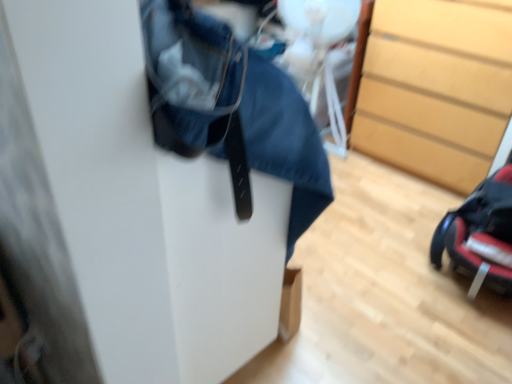
Question: Is black plastic baby carriage at lower right completely or partially outside of wooden chest of drawers at right?

Choices:
 (A) yes
 (B) no

Answer: (A)

Question: Considering the relative sizes of black plastic baby carriage at lower right and wooden chest of drawers at right in the image provided, is black plastic baby carriage at lower right wider than wooden chest of drawers at right?

Choices:
 (A) no
 (B) yes

Answer: (A)

Question: From a real-world perspective, does black plastic baby carriage at lower right stand above wooden chest of drawers at right?

Choices:
 (A) no
 (B) yes

Answer: (A)

Question: Is black plastic baby carriage at lower right closer to camera compared to wooden chest of drawers at right?

Choices:
 (A) no
 (B) yes

Answer: (B)

Question: Is black plastic baby carriage at lower right oriented towards wooden chest of drawers at right?

Choices:
 (A) no
 (B) yes

Answer: (A)

Question: Can you confirm if black plastic baby carriage at lower right is thinner than wooden chest of drawers at right?

Choices:
 (A) no
 (B) yes

Answer: (B)

Question: Does wooden chest of drawers at right have a lesser height compared to black plastic baby carriage at lower right?

Choices:
 (A) no
 (B) yes

Answer: (A)

Question: Is wooden chest of drawers at right smaller than black plastic baby carriage at lower right?

Choices:
 (A) no
 (B) yes

Answer: (A)

Question: Does wooden chest of drawers at right have a greater height compared to black plastic baby carriage at lower right?

Choices:
 (A) no
 (B) yes

Answer: (B)

Question: From the image's perspective, would you say wooden chest of drawers at right is shown under black plastic baby carriage at lower right?

Choices:
 (A) yes
 (B) no

Answer: (B)

Question: Is wooden chest of drawers at right surrounding black plastic baby carriage at lower right?

Choices:
 (A) no
 (B) yes

Answer: (A)

Question: Does wooden chest of drawers at right appear on the left side of black plastic baby carriage at lower right?

Choices:
 (A) yes
 (B) no

Answer: (B)

Question: Looking at their shapes, would you say black plastic baby carriage at lower right is wider or thinner than wooden chest of drawers at right?

Choices:
 (A) wide
 (B) thin

Answer: (B)